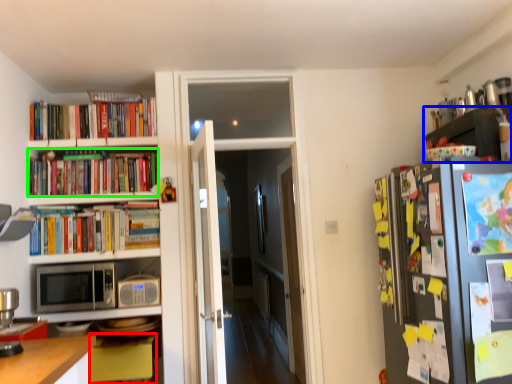
Question: Which object is the farthest from table (highlighted by a red box)? Choose among these: shelf (highlighted by a blue box) or book (highlighted by a green box).

Choices:
 (A) shelf
 (B) book

Answer: (A)